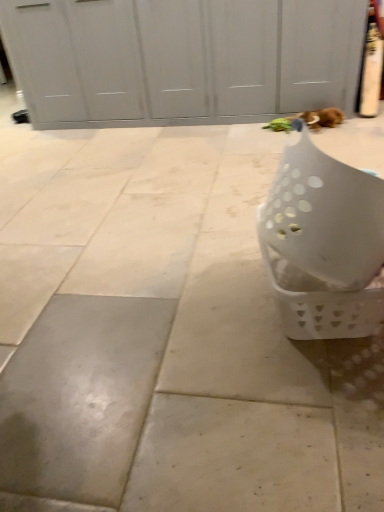
At what (x,y) coordinates should I click in order to perform the action: click on free space in front of white plastic basket at lower right. Please return your answer as a coordinate pair (x, y). Image resolution: width=384 pixels, height=512 pixels. Looking at the image, I should click on (311, 405).